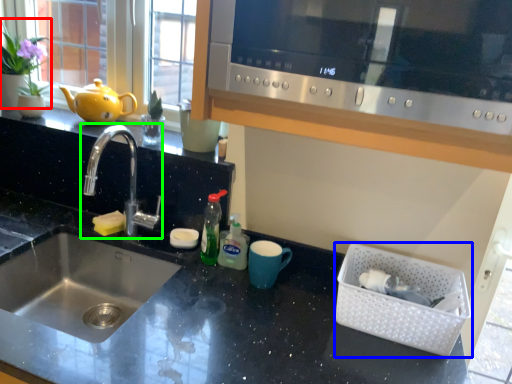
Question: Which object is positioned farthest from plant (highlighted by a red box)? Select from basket (highlighted by a blue box) and tap (highlighted by a green box).

Choices:
 (A) basket
 (B) tap

Answer: (A)